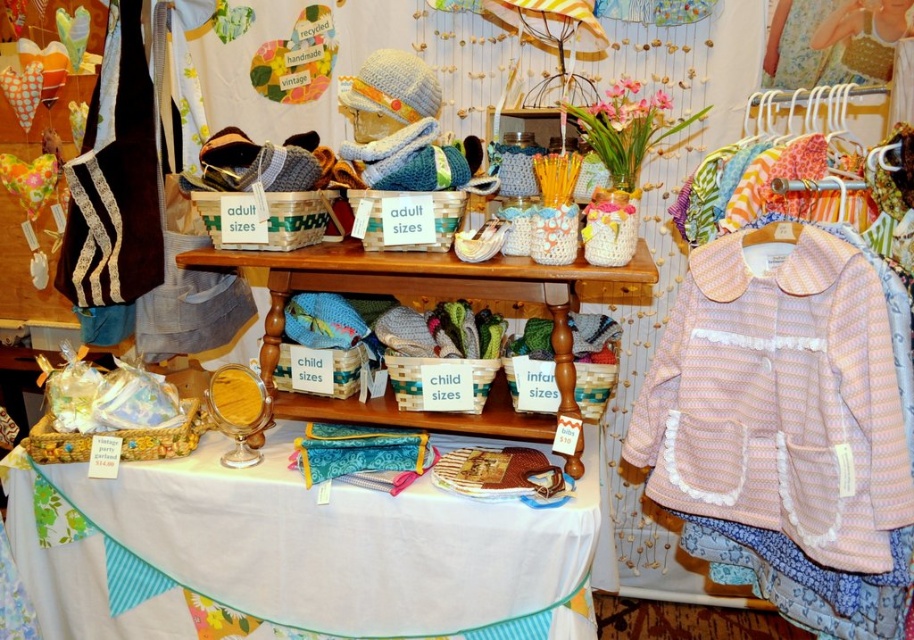
Question: Which point is farther to the camera?

Choices:
 (A) (309, 276)
 (B) (785, 492)
 (C) (312, 442)

Answer: (A)

Question: Does teal fabric purse at lower center lie behind wooden table at center?

Choices:
 (A) no
 (B) yes

Answer: (B)

Question: Which object appears closest to the camera in this image?

Choices:
 (A) wooden table at center
 (B) teal fabric purse at lower center

Answer: (A)

Question: Is teal fabric purse at lower center closer to the viewer compared to brown velvet bag at left?

Choices:
 (A) no
 (B) yes

Answer: (B)

Question: Is pink striped fabric jacket at center to the left of brown velvet bag at left from the viewer's perspective?

Choices:
 (A) no
 (B) yes

Answer: (A)

Question: Which point is closer to the camera taking this photo?

Choices:
 (A) (643, 275)
 (B) (131, 236)
 (C) (838, 305)

Answer: (C)